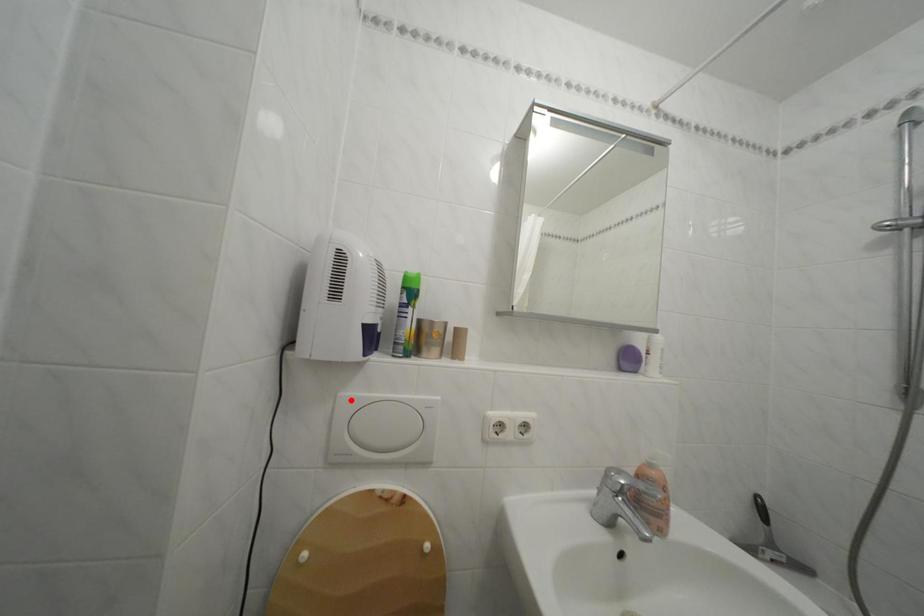
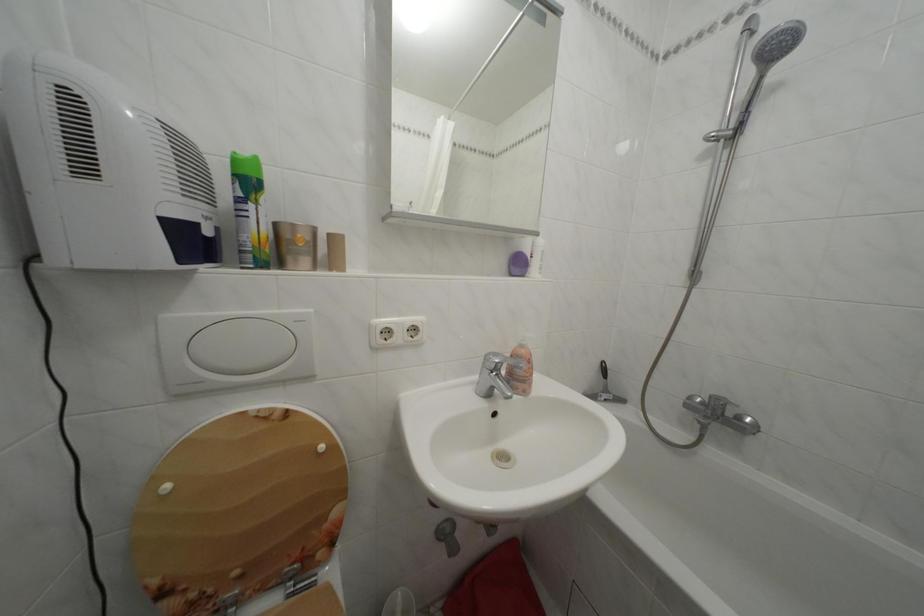
The point at the highlighted location is marked in the first image. Where is the corresponding point in the second image?

(174, 323)